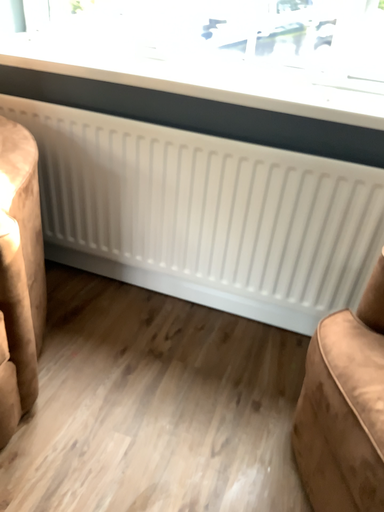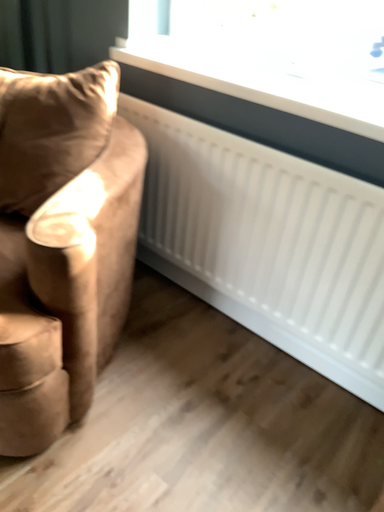
Question: Which way did the camera rotate in the video?

Choices:
 (A) rotated left
 (B) rotated right

Answer: (A)